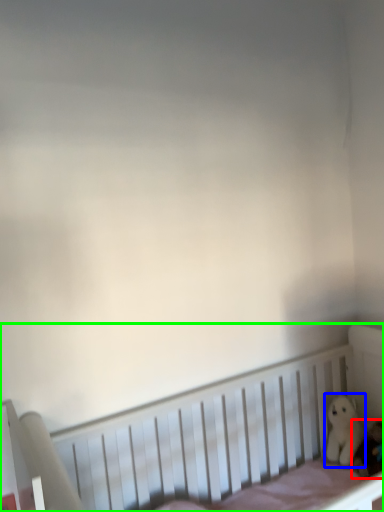
Question: Which object is positioned closest to toy (highlighted by a red box)? Select from toy (highlighted by a blue box) and infant bed (highlighted by a green box).

Choices:
 (A) toy
 (B) infant bed

Answer: (A)